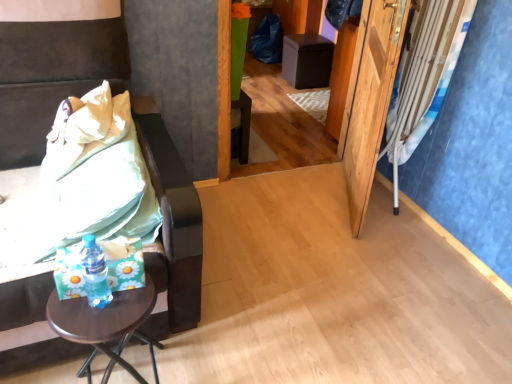
The height and width of the screenshot is (384, 512). I want to click on vacant space underneath blue fabric curtain at right (from a real-world perspective), so click(385, 193).